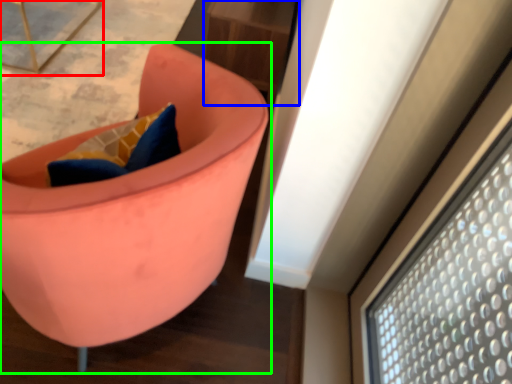
Question: Estimate the real-world distances between objects in this image. Which object is farther from furniture (highlighted by a red box), table (highlighted by a blue box) or chair (highlighted by a green box)?

Choices:
 (A) table
 (B) chair

Answer: (B)